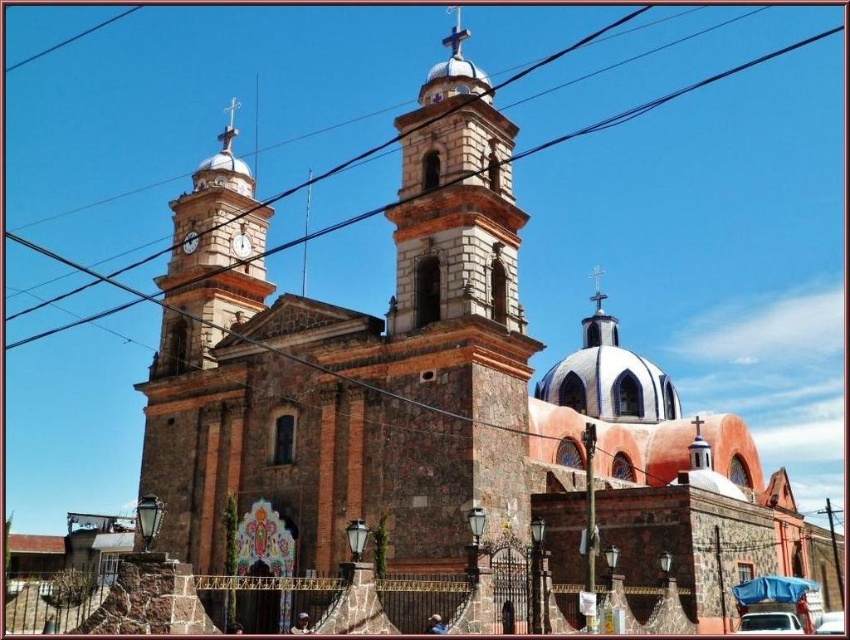
Question: Is brick clock tower at left below matte white clock at upper center?

Choices:
 (A) yes
 (B) no

Answer: (B)

Question: Which of the following is the farthest from the observer?

Choices:
 (A) (765, 616)
 (B) (238, 237)
 (C) (242, 218)

Answer: (C)

Question: Which point is closer to the camera?

Choices:
 (A) (196, 232)
 (B) (187, 216)
 (C) (761, 616)
 (D) (813, 630)

Answer: (C)

Question: Does brick clock tower at left have a smaller size compared to white matte car at lower right?

Choices:
 (A) no
 (B) yes

Answer: (A)

Question: Among these points, which one is nearest to the camera?

Choices:
 (A) (225, 140)
 (B) (833, 614)
 (C) (774, 621)

Answer: (C)

Question: Does white stone bell tower at center appear on the left side of white matte car at lower right?

Choices:
 (A) no
 (B) yes

Answer: (B)